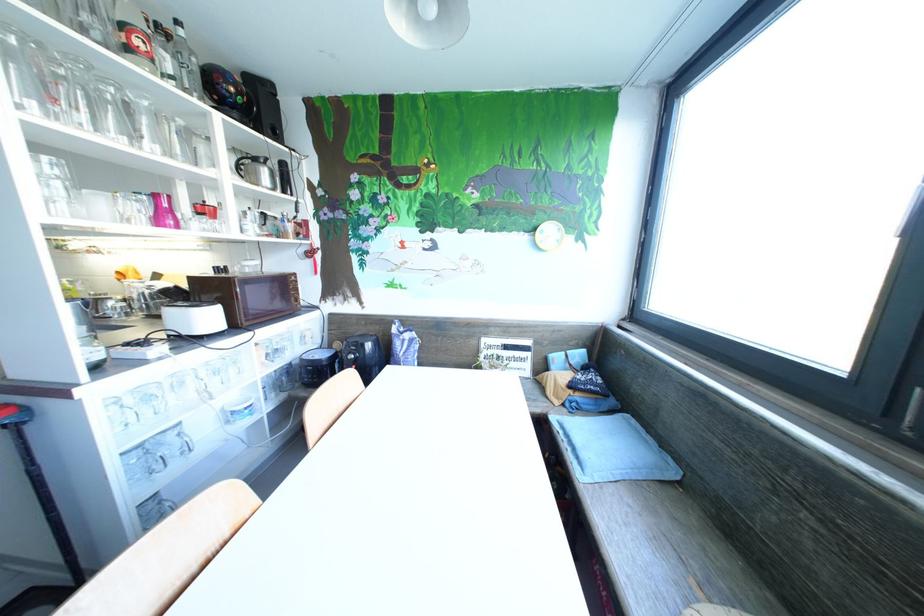
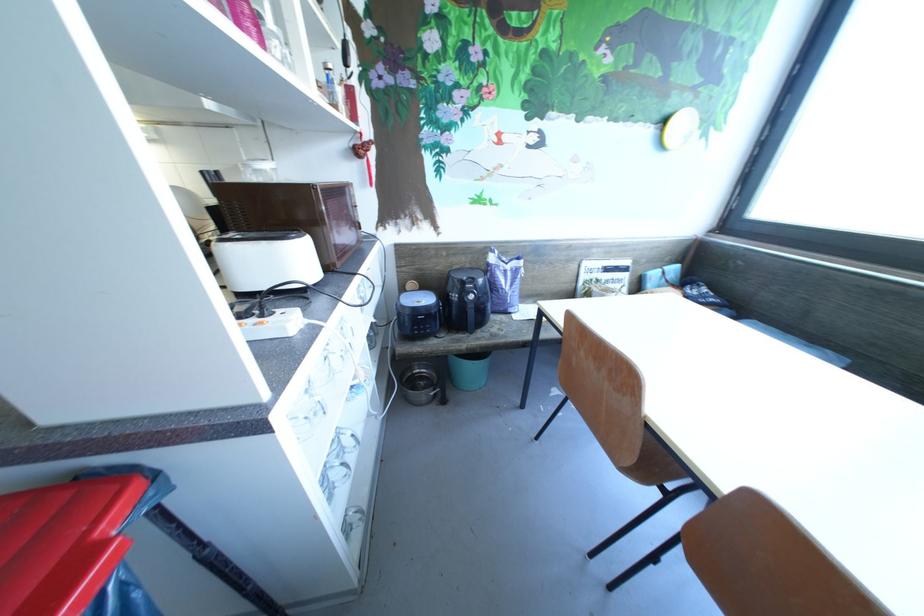
The point at [30,413] is marked in the first image. Where is the corresponding point in the second image?

(162, 477)